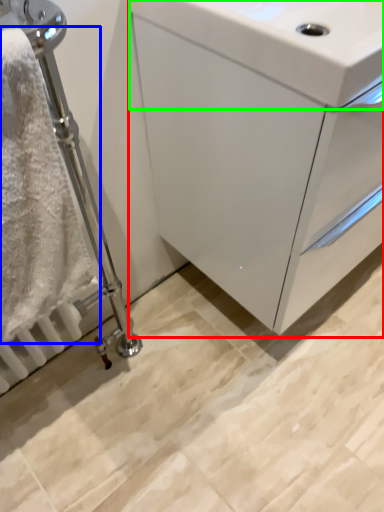
Question: Which object is positioned farthest from bathroom cabinet (highlighted by a red box)? Select from bath towel (highlighted by a blue box) and sink (highlighted by a green box).

Choices:
 (A) bath towel
 (B) sink

Answer: (A)